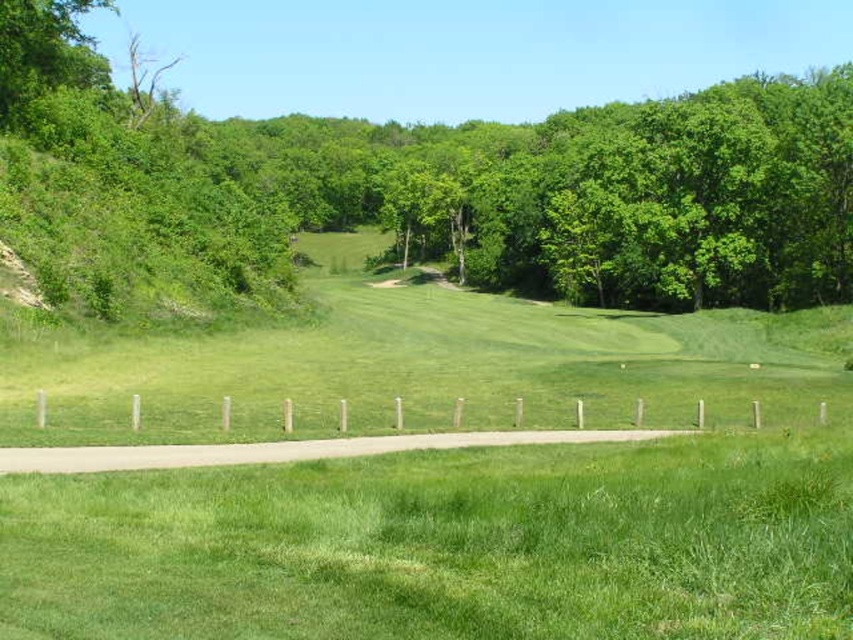
Question: Where is green leafy tree at center located in relation to green grass at lower center in the image?

Choices:
 (A) above
 (B) below

Answer: (A)

Question: Which of the following is the farthest from the observer?

Choices:
 (A) green grass at lower center
 (B) green leafy tree at center

Answer: (B)

Question: Can you confirm if green leafy tree at center is positioned below green grass at lower center?

Choices:
 (A) no
 (B) yes

Answer: (A)

Question: In this image, where is green leafy tree at center located relative to green grass at lower center?

Choices:
 (A) above
 (B) below

Answer: (A)